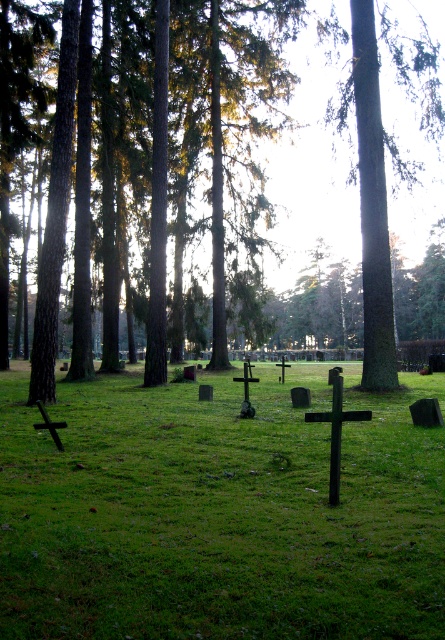
Is green grassy at center thinner than green rough bark tree at center?

In fact, green grassy at center might be wider than green rough bark tree at center.

Does green grassy at center lie behind green rough bark tree at center?

No, green grassy at center is closer to the viewer.

Does point (9, 602) come closer to viewer compared to point (425, 83)?

Yes, point (9, 602) is in front of point (425, 83).

Image resolution: width=445 pixels, height=640 pixels. Identify the location of green grassy at center. (219, 513).

Is brown wood tree at center to the right of green rough bark tree at center from the viewer's perspective?

In fact, brown wood tree at center is to the left of green rough bark tree at center.

Who is more distant from viewer, (186, 150) or (433, 84)?

Point (186, 150)

Is point (234, 154) closer to camera compared to point (357, 13)?

No, (234, 154) is further to viewer.

Find the location of a particular element. brown wood tree at center is located at coordinates (376, 236).

Is green grassy at center below brown wood tree at center?

Yes, green grassy at center is below brown wood tree at center.

Does green grassy at center have a larger size compared to brown wood tree at center?

No, green grassy at center is not bigger than brown wood tree at center.

Between point (81, 504) and point (392, 93), which one is positioned in front?

Point (81, 504) is in front.

I want to click on green grassy at center, so click(x=219, y=513).